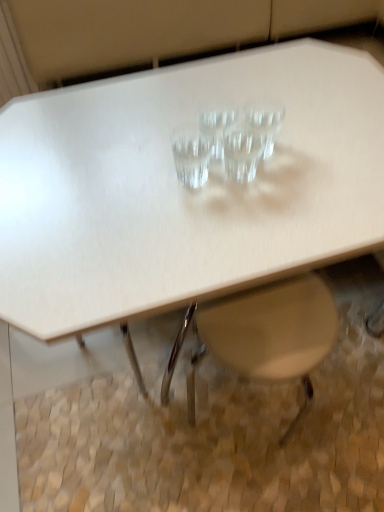
I want to click on free spot to the left of transparent glass martini glass at center, marked as the fourth martini glass in a right-to-left arrangement, so click(111, 179).